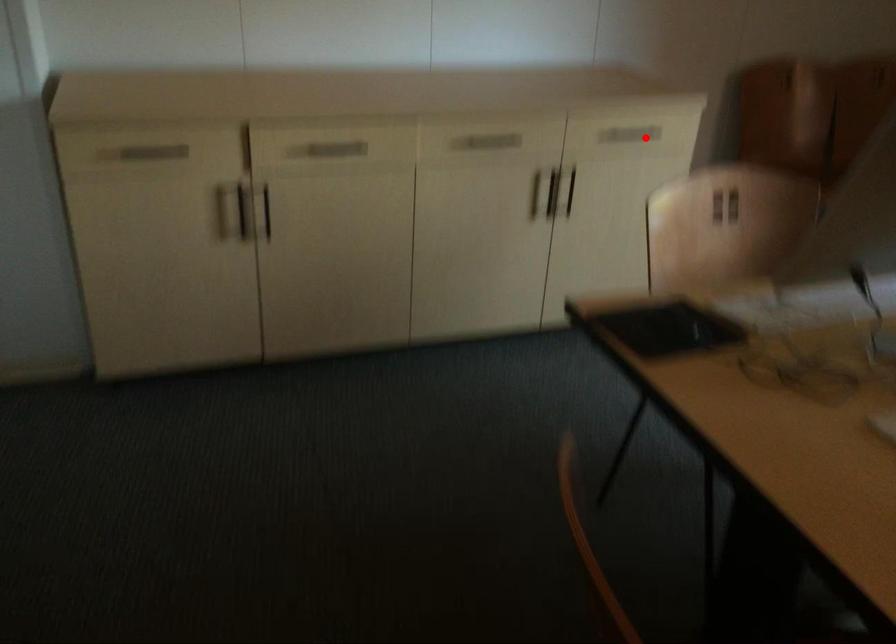
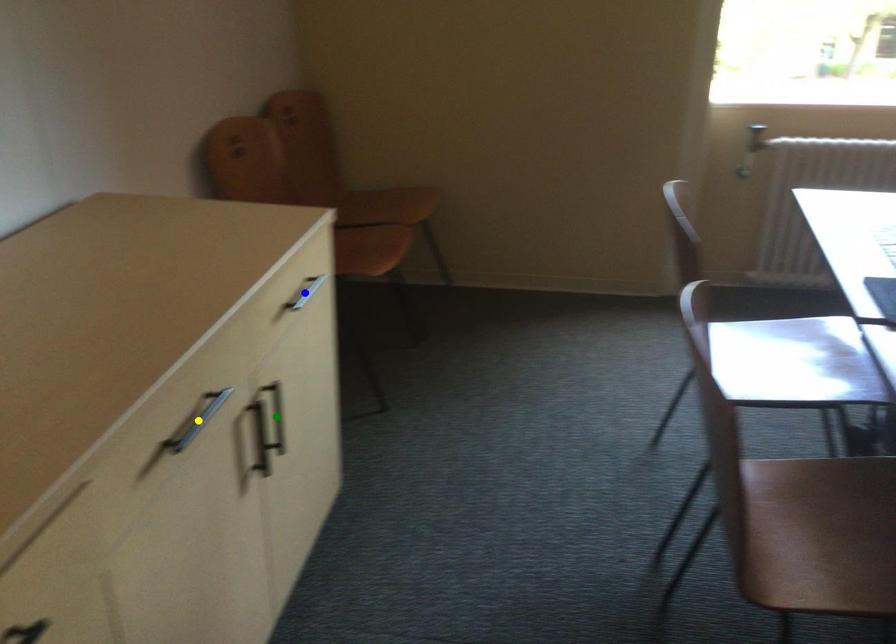
Question: I am providing you with two images of the same scene from different viewpoints. A red point is marked on the first image. You are given multiple points on the second image. Can you choose the point in image 2 that corresponds to the point in image 1?

Choices:
 (A) yellow point
 (B) blue point
 (C) green point

Answer: (B)